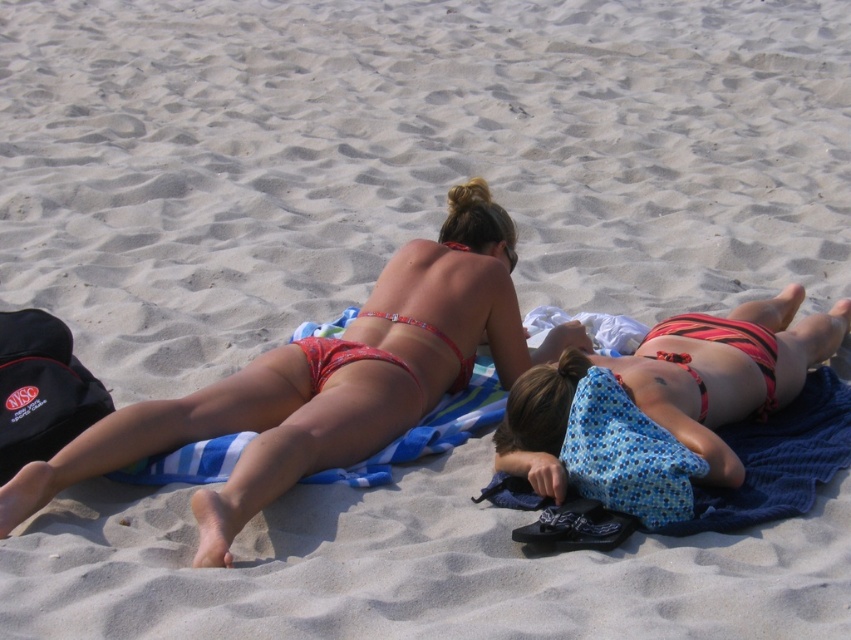
You are a photographer trying to capture a closeup of the matte red bikini at upper center and the red matte bikini top at center. Which one should you focus on first to ensure it appears sharp in the photo?

The matte red bikini at upper center is in front of the red matte bikini top at center, so you should focus on the matte red bikini at upper center first to ensure it appears sharp in the photo.

You are a photographer taking a beach photo and need to position two models wearing bikinis. The models are wearing a matte red bikini at upper center and a striped bikini at center. According to the scene, which model is positioned to the left when viewed from the photographer perspective?

The matte red bikini at upper center is positioned to the left of the striped bikini at center, so the model wearing the matte red bikini at upper center is on the left side.

You are a photographer trying to capture a closeup of the striped bikini at center and the red matte bikini top at center. Which one is closer to the camera?

The striped bikini at center is positioned under the red matte bikini top at center, meaning the red matte bikini top at center is closer to the camera.